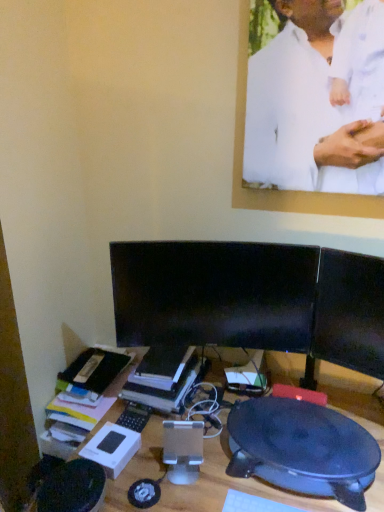
Identify the location of blank space situated above black plastic round table at lower right (from a real-world perspective). This screenshot has height=512, width=384. (311, 440).